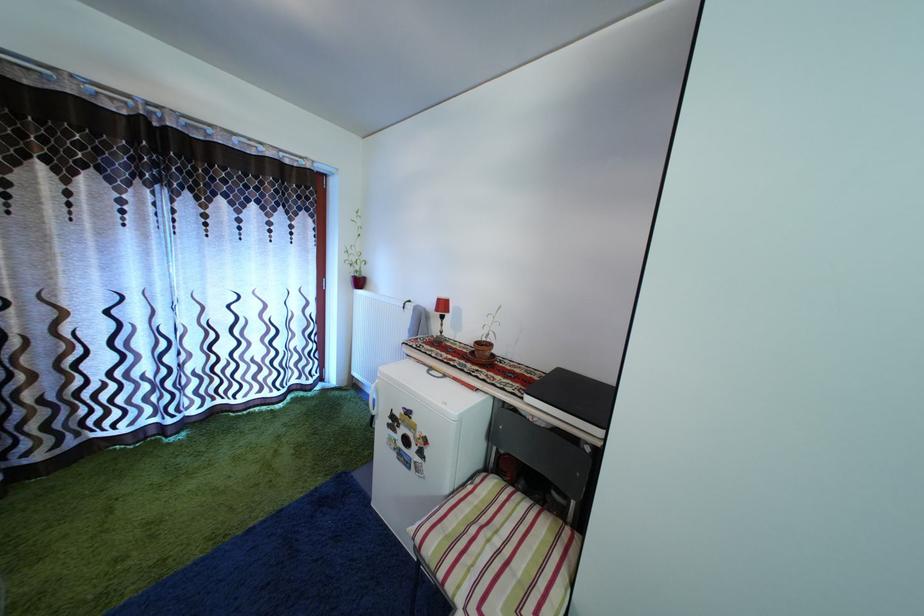
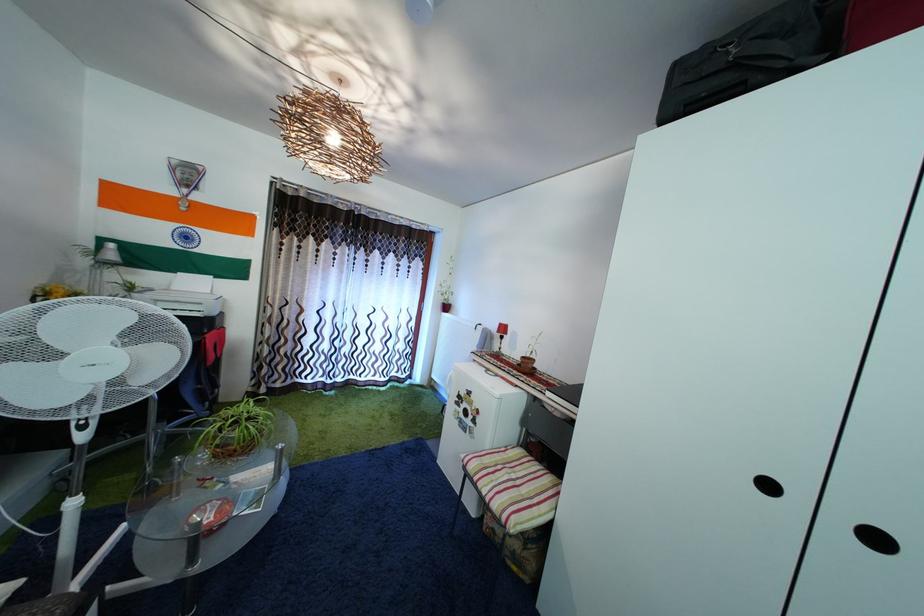
Question: In a continuous first-person perspective shot, in which direction is the camera moving?

Choices:
 (A) Left
 (B) Right
 (C) Forward
 (D) Backward

Answer: (D)